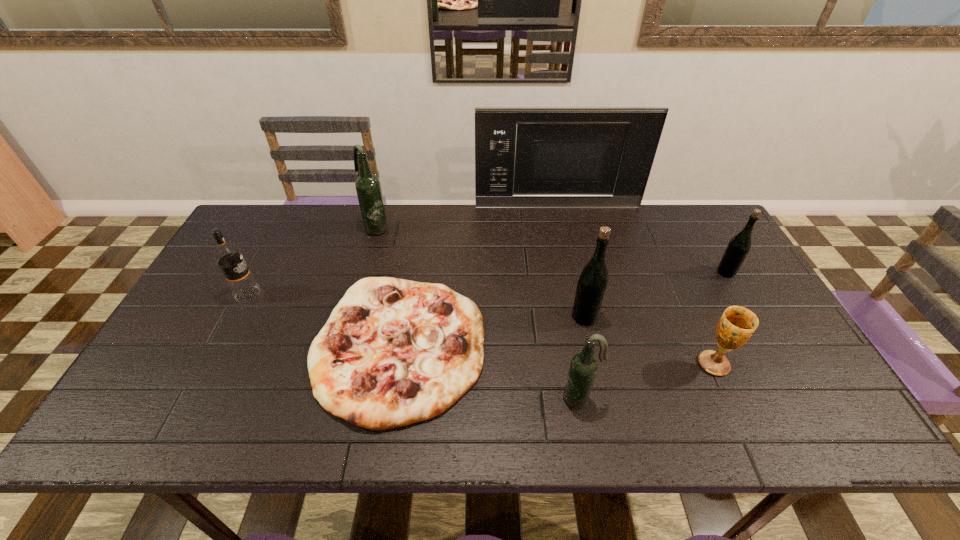
Where is `vacant space located 0.200m on the left of the pizza`? This screenshot has height=540, width=960. vacant space located 0.200m on the left of the pizza is located at coordinates (233, 347).

The image size is (960, 540). Find the location of `microwave oven located at the far edge`. microwave oven located at the far edge is located at coordinates (552, 157).

I want to click on beer bottle that is at the far edge, so click(x=368, y=188).

Where is `beer bottle that is at the near edge`? Image resolution: width=960 pixels, height=540 pixels. beer bottle that is at the near edge is located at coordinates (583, 367).

Identify the location of pizza that is at the near edge. The width and height of the screenshot is (960, 540). (394, 352).

You are a GUI agent. You are given a task and a screenshot of the screen. Output one action in this format:
    pyautogui.click(x=<x>, y=<y>)
    Task: Click on the object that is at the left edge
    The image size is (960, 540).
    Given the screenshot: What is the action you would take?
    pyautogui.click(x=228, y=256)

You are a GUI agent. You are given a task and a screenshot of the screen. Output one action in this format:
    pyautogui.click(x=<x>, y=<y>)
    Task: Click on the object that is at the right edge
    
    Given the screenshot: What is the action you would take?
    pyautogui.click(x=739, y=246)

In the image, there is a desktop. Identify the location of vacant space at the far edge. (507, 224).

Where is `free space at the near edge`? free space at the near edge is located at coordinates (453, 415).

In order to click on free space at the left edge in this screenshot , I will do `click(235, 326)`.